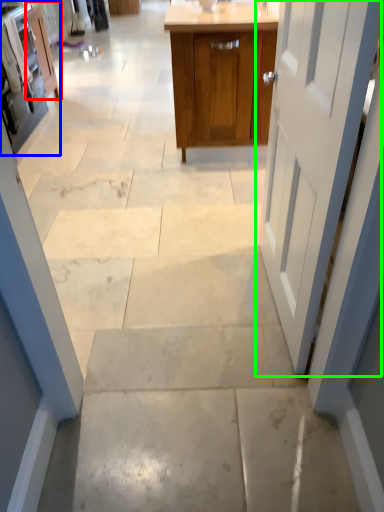
Question: Based on their relative distances, which object is nearer to cabinetry (highlighted by a red box)? Choose from cabinetry (highlighted by a blue box) and door (highlighted by a green box).

Choices:
 (A) cabinetry
 (B) door

Answer: (A)